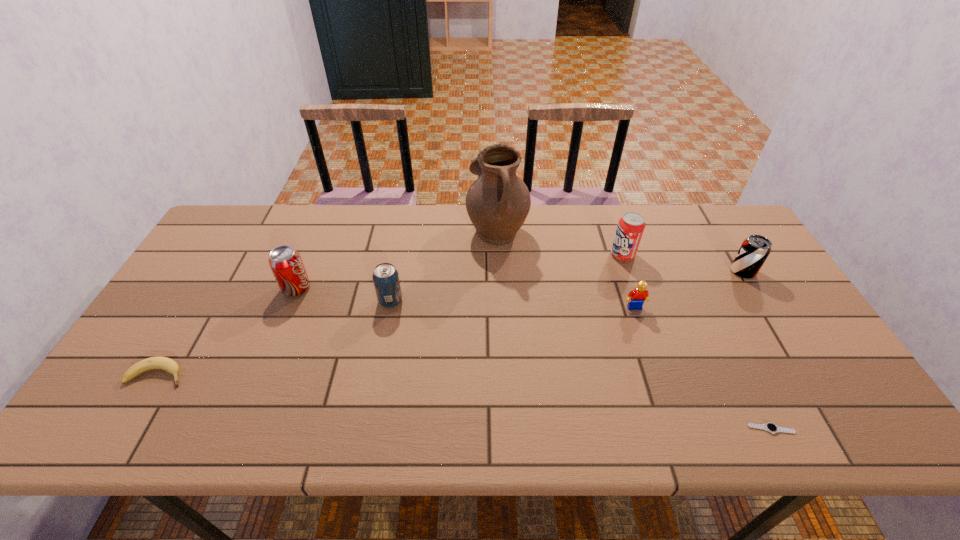
You are a GUI agent. You are given a task and a screenshot of the screen. Output one action in this format:
    pyautogui.click(x=<x>, y=<y>)
    Task: Click on the vacant space that satisfies the following two spatial constraints: 1. at the spout of the pitcher; 2. on the back side of the watch
    The image size is (960, 540).
    Given the screenshot: What is the action you would take?
    coord(506,429)

The image size is (960, 540). What are the coordinates of `vacant space that satisfies the following two spatial constraints: 1. on the back side of the watch; 2. at the spout of the fourth object from left to right` in the screenshot? It's located at (673, 228).